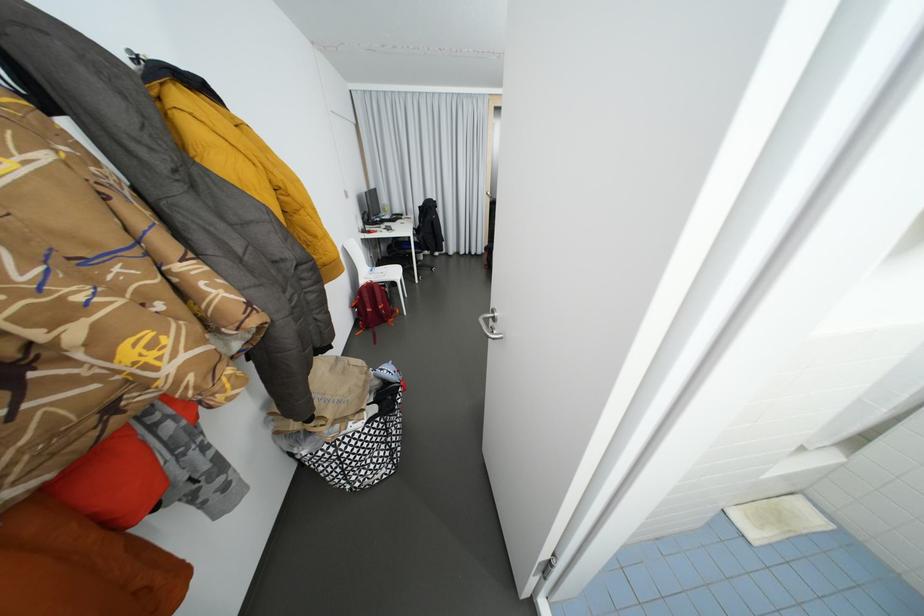
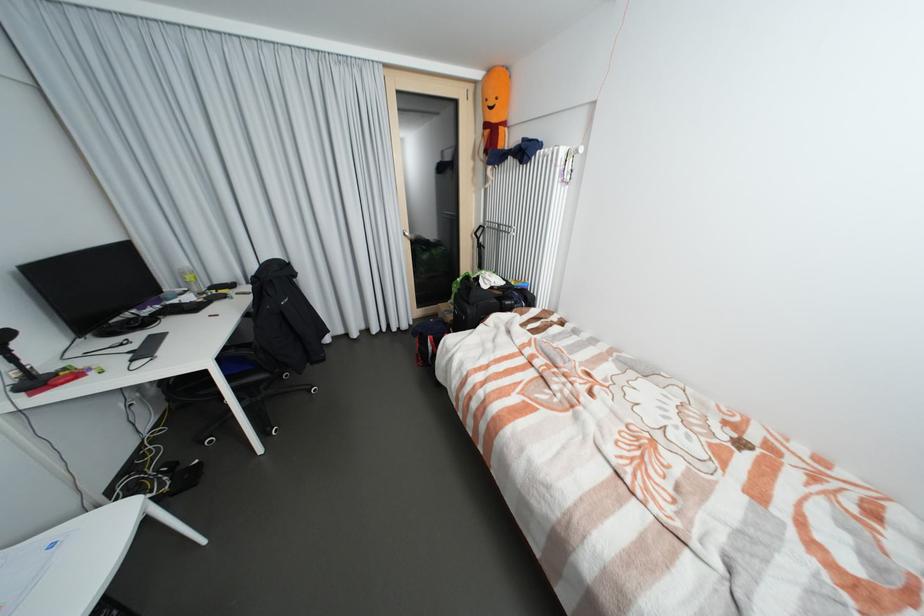
Question: The images are taken continuously from a first-person perspective. In which direction are you moving?

Choices:
 (A) Left
 (B) Right
 (C) Forward
 (D) Backward

Answer: (C)